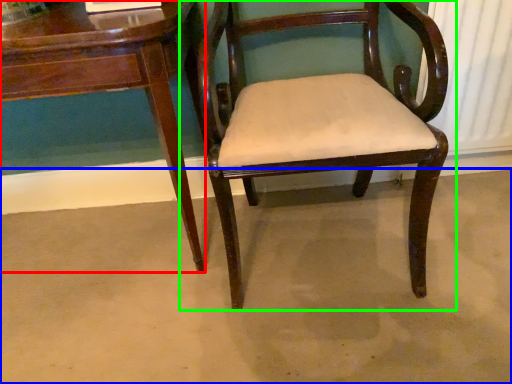
Question: Which object is the farthest from table (highlighted by a red box)? Choose among these: concrete (highlighted by a blue box) or chair (highlighted by a green box).

Choices:
 (A) concrete
 (B) chair

Answer: (A)